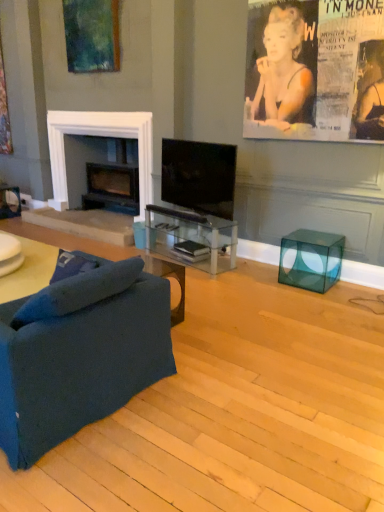
Question: Is matte black book at center, marked as the 1th magazine in a top-to-bottom arrangement, further to the viewer compared to transparent glass cube at lower right?

Choices:
 (A) yes
 (B) no

Answer: (A)

Question: From a real-world perspective, is matte black book at center, which ranks as the 2th magazine in bottom-to-top order, beneath transparent glass cube at lower right?

Choices:
 (A) no
 (B) yes

Answer: (B)

Question: Is matte black book at center, which ranks as the 2th magazine in bottom-to-top order, aimed at transparent glass cube at lower right?

Choices:
 (A) no
 (B) yes

Answer: (A)

Question: Can transparent glass cube at lower right be found inside matte black book at center, marked as the 1th magazine in a top-to-bottom arrangement?

Choices:
 (A) yes
 (B) no

Answer: (B)

Question: Can you confirm if matte black book at center, which ranks as the 2th magazine in bottom-to-top order, is taller than transparent glass cube at lower right?

Choices:
 (A) yes
 (B) no

Answer: (B)

Question: Is black glossy tv at center bigger or smaller than matte black book at center, marked as the 1th magazine in a top-to-bottom arrangement?

Choices:
 (A) big
 (B) small

Answer: (A)

Question: Is black glossy tv at center in front of or behind matte black book at center, marked as the 1th magazine in a top-to-bottom arrangement, in the image?

Choices:
 (A) behind
 (B) front

Answer: (B)

Question: Considering the positions of black glossy tv at center and matte black book at center, marked as the 1th magazine in a top-to-bottom arrangement, in the image, is black glossy tv at center wider or thinner than matte black book at center, marked as the 1th magazine in a top-to-bottom arrangement,?

Choices:
 (A) thin
 (B) wide

Answer: (A)

Question: Considering the positions of point (190, 161) and point (200, 245), is point (190, 161) closer or farther from the camera than point (200, 245)?

Choices:
 (A) closer
 (B) farther

Answer: (A)

Question: Looking at their shapes, would you say transparent glass tv stand at center is wider or thinner than black matte fireplace at left?

Choices:
 (A) thin
 (B) wide

Answer: (A)

Question: Is transparent glass tv stand at center in front of or behind black matte fireplace at left in the image?

Choices:
 (A) behind
 (B) front

Answer: (B)

Question: Is point (150, 239) positioned closer to the camera than point (54, 180)?

Choices:
 (A) closer
 (B) farther

Answer: (A)

Question: From the image's perspective, relative to black matte fireplace at left, is transparent glass tv stand at center above or below?

Choices:
 (A) above
 (B) below

Answer: (B)

Question: Is matte black magazine at center, marked as the 2th magazine in a top-to-bottom arrangement, to the left or to the right of black matte fireplace at left in the image?

Choices:
 (A) right
 (B) left

Answer: (A)

Question: Considering their positions, is matte black magazine at center, marked as the 2th magazine in a top-to-bottom arrangement, located in front of or behind black matte fireplace at left?

Choices:
 (A) behind
 (B) front

Answer: (B)